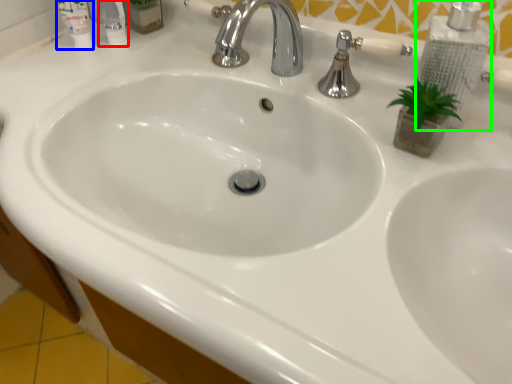
Question: Considering the real-world distances, which object is closest to mouthwash (highlighted by a red box)? mouthwash (highlighted by a blue box) or soap dispenser (highlighted by a green box).

Choices:
 (A) mouthwash
 (B) soap dispenser

Answer: (A)